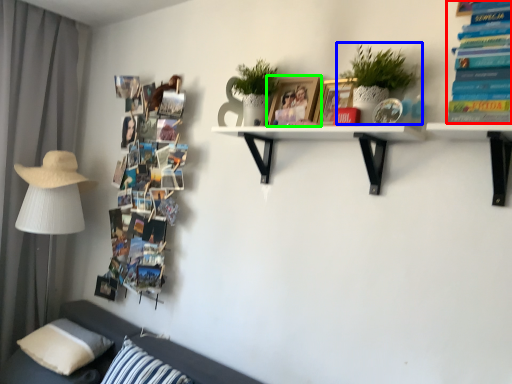
Question: Estimate the real-world distances between objects in this image. Which object is farther from book (highlighted by a red box), houseplant (highlighted by a blue box) or picture frame (highlighted by a green box)?

Choices:
 (A) houseplant
 (B) picture frame

Answer: (B)